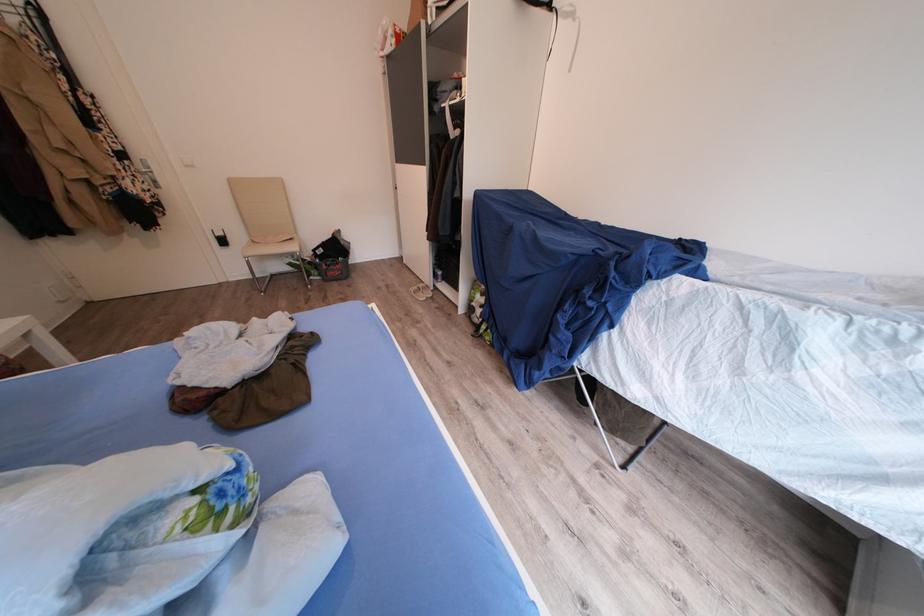
Identify the location of chair sitting surface. (271, 243).